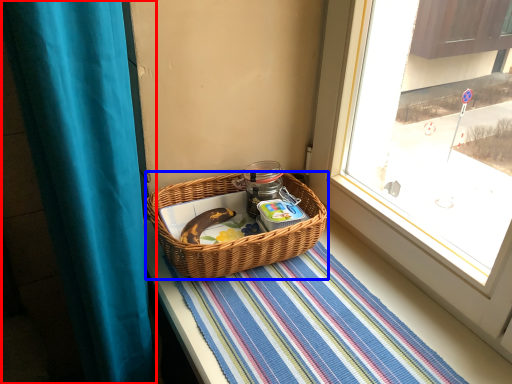
Question: Which object is closer to the camera taking this photo, curtain (highlighted by a red box) or picnic basket (highlighted by a blue box)?

Choices:
 (A) curtain
 (B) picnic basket

Answer: (A)